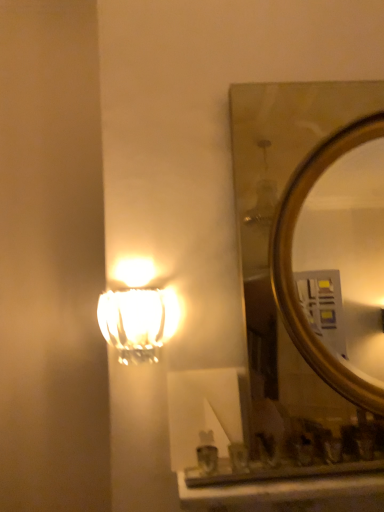
Question: Considering the relative positions of translucent glass lamp at upper left and gold metallic mirror at upper right in the image provided, is translucent glass lamp at upper left to the right of gold metallic mirror at upper right from the viewer's perspective?

Choices:
 (A) no
 (B) yes

Answer: (A)

Question: Is translucent glass lamp at upper left directly adjacent to gold metallic mirror at upper right?

Choices:
 (A) yes
 (B) no

Answer: (B)

Question: Is translucent glass lamp at upper left positioned before gold metallic mirror at upper right?

Choices:
 (A) no
 (B) yes

Answer: (B)

Question: Is translucent glass lamp at upper left behind gold metallic mirror at upper right?

Choices:
 (A) yes
 (B) no

Answer: (B)

Question: Is translucent glass lamp at upper left far away from gold metallic mirror at upper right?

Choices:
 (A) no
 (B) yes

Answer: (B)

Question: Considering the relative sizes of translucent glass lamp at upper left and gold metallic mirror at upper right in the image provided, is translucent glass lamp at upper left bigger than gold metallic mirror at upper right?

Choices:
 (A) yes
 (B) no

Answer: (B)

Question: Is gold metallic mirror at upper right surrounding translucent glass lamp at upper left?

Choices:
 (A) no
 (B) yes

Answer: (A)

Question: Can you confirm if gold metallic mirror at upper right is taller than translucent glass lamp at upper left?

Choices:
 (A) yes
 (B) no

Answer: (A)

Question: From the image's perspective, does gold metallic mirror at upper right appear higher than translucent glass lamp at upper left?

Choices:
 (A) no
 (B) yes

Answer: (B)

Question: Is gold metallic mirror at upper right facing away from translucent glass lamp at upper left?

Choices:
 (A) no
 (B) yes

Answer: (A)

Question: Does gold metallic mirror at upper right have a larger size compared to translucent glass lamp at upper left?

Choices:
 (A) yes
 (B) no

Answer: (A)

Question: Is gold metallic mirror at upper right located outside translucent glass lamp at upper left?

Choices:
 (A) no
 (B) yes

Answer: (B)

Question: From the image's perspective, is gold metallic mirror at upper right above or below translucent glass lamp at upper left?

Choices:
 (A) above
 (B) below

Answer: (A)